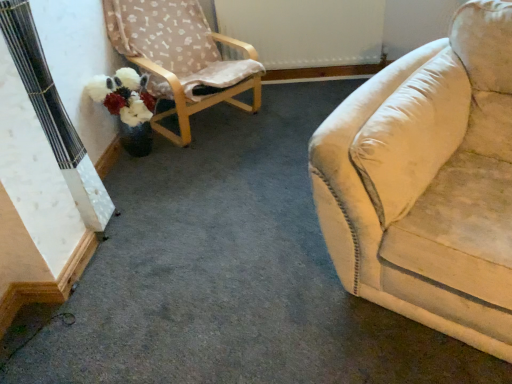
Question: Is wooden chair with fabric cover at upper left taller or shorter than fluffy white flower at lower left?

Choices:
 (A) short
 (B) tall

Answer: (B)

Question: Would you say wooden chair with fabric cover at upper left is inside or outside fluffy white flower at lower left?

Choices:
 (A) outside
 (B) inside

Answer: (A)

Question: Is point (185, 77) closer or farther from the camera than point (130, 82)?

Choices:
 (A) farther
 (B) closer

Answer: (A)

Question: In the image, is fluffy white flower at lower left on the left side or the right side of wooden chair with fabric cover at upper left?

Choices:
 (A) right
 (B) left

Answer: (B)

Question: Is fluffy white flower at lower left situated inside wooden chair with fabric cover at upper left or outside?

Choices:
 (A) outside
 (B) inside

Answer: (A)

Question: In the image, is fluffy white flower at lower left positioned in front of or behind wooden chair with fabric cover at upper left?

Choices:
 (A) behind
 (B) front

Answer: (A)

Question: From a real-world perspective, is fluffy white flower at lower left physically located above or below wooden chair with fabric cover at upper left?

Choices:
 (A) above
 (B) below

Answer: (B)